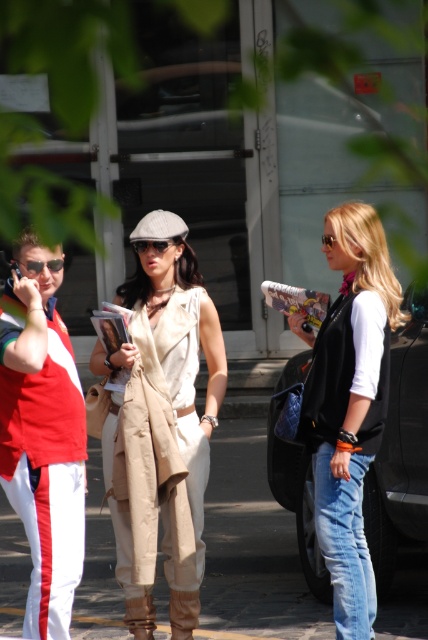
Question: Is matte black sunglasses at center positioned behind matte black sunglasses at left?

Choices:
 (A) no
 (B) yes

Answer: (B)

Question: Among these objects, which one is farthest from the camera?

Choices:
 (A) black glossy car at center
 (B) beige fabric dress at center
 (C) matte black sunglasses at left
 (D) matte black sunglasses at center

Answer: (A)

Question: In this image, where is black glossy car at center located relative to matte black sunglasses at left?

Choices:
 (A) right
 (B) left

Answer: (A)

Question: Which object is farther from the camera taking this photo?

Choices:
 (A) black glossy car at center
 (B) beige fabric dress at center
 (C) matte black sunglasses at left

Answer: (A)

Question: Which point is farther from the camera taking this photo?

Choices:
 (A) (189, 502)
 (B) (154, 250)
 (C) (47, 268)
 (D) (424, 332)

Answer: (D)

Question: Is black glossy car at center positioned in front of matte black sunglasses at left?

Choices:
 (A) no
 (B) yes

Answer: (A)